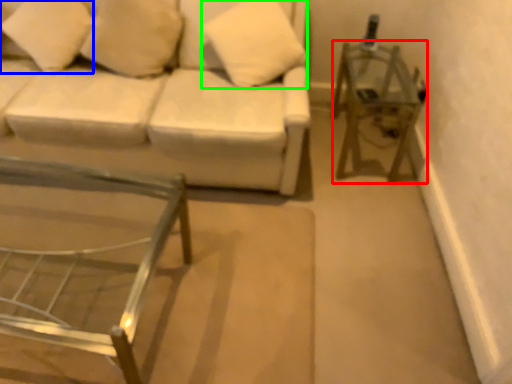
Question: Which object is positioned farthest from side table (highlighted by a red box)? Select from pillow (highlighted by a blue box) and pillow (highlighted by a green box).

Choices:
 (A) pillow
 (B) pillow

Answer: (A)